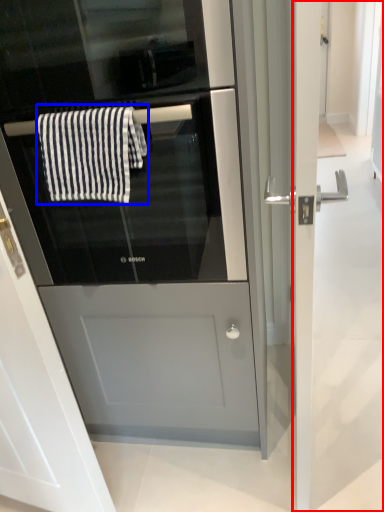
Question: Among these objects, which one is nearest to the camera, screen door (highlighted by a red box) or bath towel (highlighted by a blue box)?

Choices:
 (A) screen door
 (B) bath towel

Answer: (A)